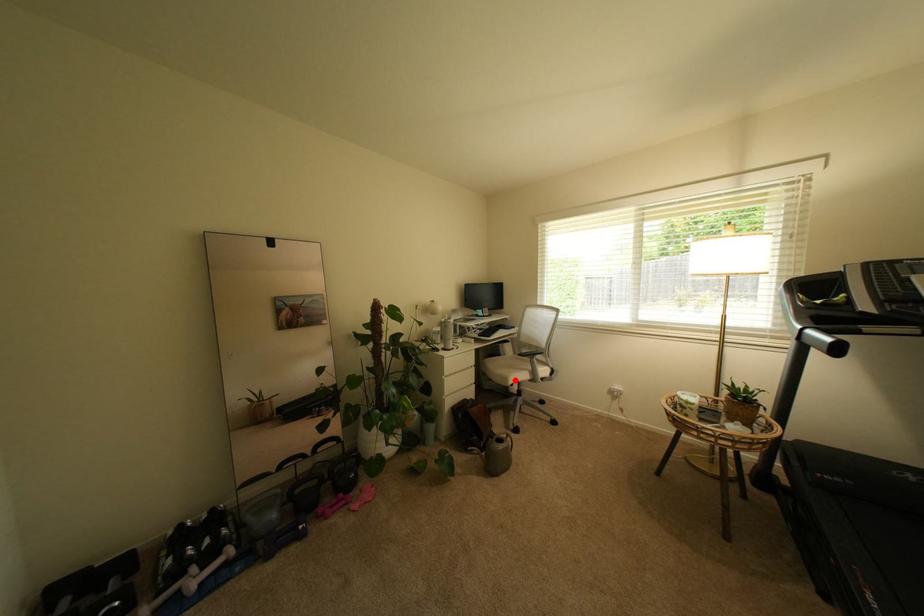
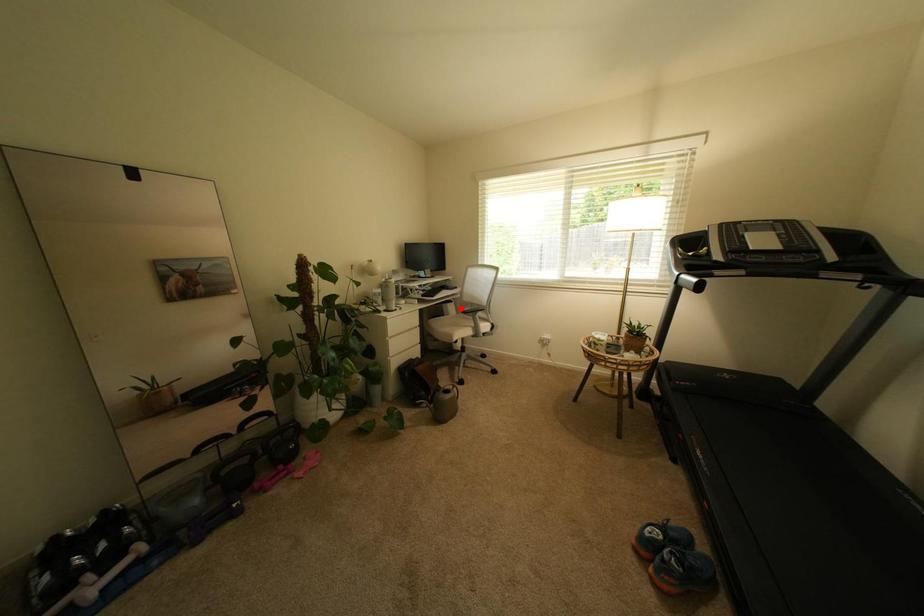
I am providing you with two images of the same scene from different viewpoints. A red point is marked on the first image and another point is marked on the second image. Is the red point in image1 aligned with the point shown in image2?

No